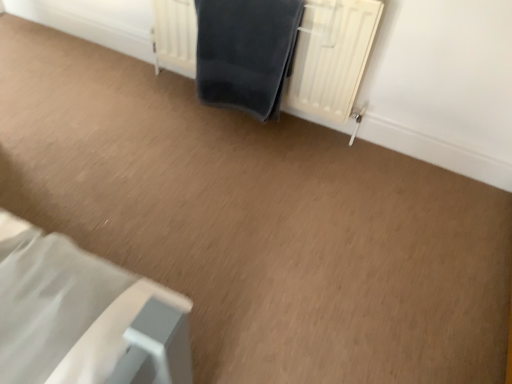
Question: Can you confirm if white textured radiator at upper center is positioned to the left of dark blue fabric at center?

Choices:
 (A) yes
 (B) no

Answer: (B)

Question: From the image's perspective, does white textured radiator at upper center appear lower than dark blue fabric at center?

Choices:
 (A) yes
 (B) no

Answer: (B)

Question: From a real-world perspective, does white textured radiator at upper center sit lower than dark blue fabric at center?

Choices:
 (A) no
 (B) yes

Answer: (B)

Question: Does white textured radiator at upper center lie in front of dark blue fabric at center?

Choices:
 (A) no
 (B) yes

Answer: (B)

Question: Considering the relative positions of white textured radiator at upper center and dark blue fabric at center in the image provided, is white textured radiator at upper center behind dark blue fabric at center?

Choices:
 (A) yes
 (B) no

Answer: (B)

Question: Is white textured radiator at upper center surrounding dark blue fabric at center?

Choices:
 (A) yes
 (B) no

Answer: (A)

Question: From a real-world perspective, is dark blue fabric at center positioned under white textured radiator at upper center based on gravity?

Choices:
 (A) no
 (B) yes

Answer: (A)

Question: From the image's perspective, would you say dark blue fabric at center is positioned over white textured radiator at upper center?

Choices:
 (A) no
 (B) yes

Answer: (A)

Question: Does dark blue fabric at center have a greater height compared to white textured radiator at upper center?

Choices:
 (A) yes
 (B) no

Answer: (B)

Question: Is there a large distance between dark blue fabric at center and white textured radiator at upper center?

Choices:
 (A) yes
 (B) no

Answer: (B)

Question: Does dark blue fabric at center turn towards white textured radiator at upper center?

Choices:
 (A) no
 (B) yes

Answer: (B)

Question: From the image's perspective, would you say dark blue fabric at center is shown under white textured radiator at upper center?

Choices:
 (A) no
 (B) yes

Answer: (B)

Question: Looking at the image, does white textured radiator at upper center seem bigger or smaller compared to dark blue fabric at center?

Choices:
 (A) small
 (B) big

Answer: (B)